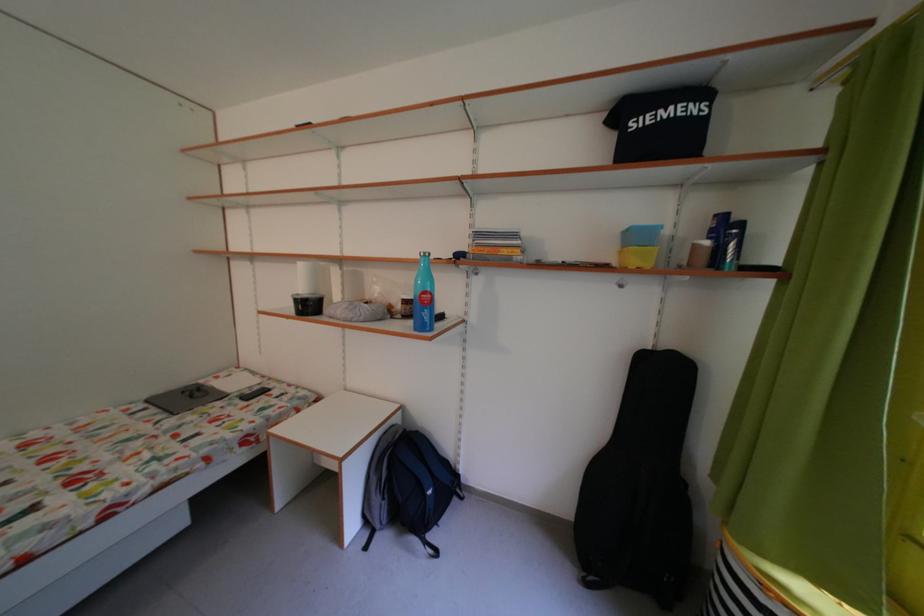
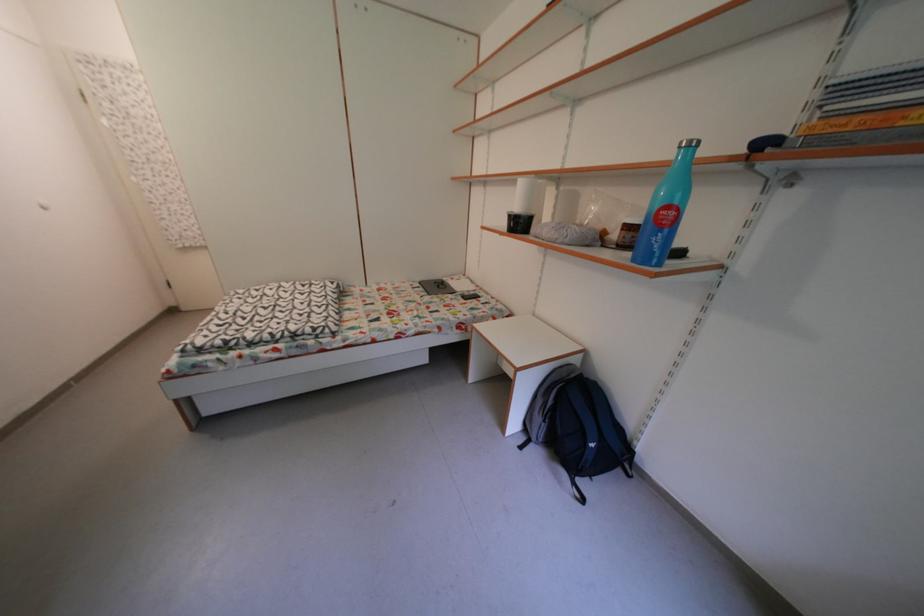
Based on the continuous images, in which direction is the camera rotating?

The rotation direction of the camera is left-down.